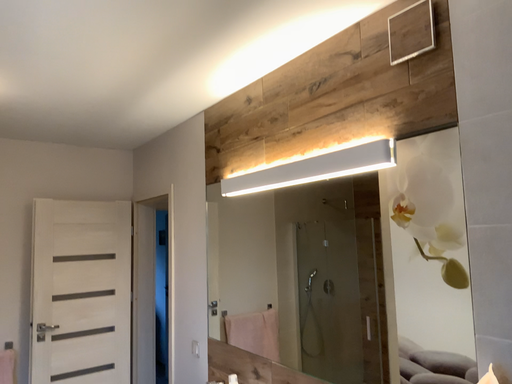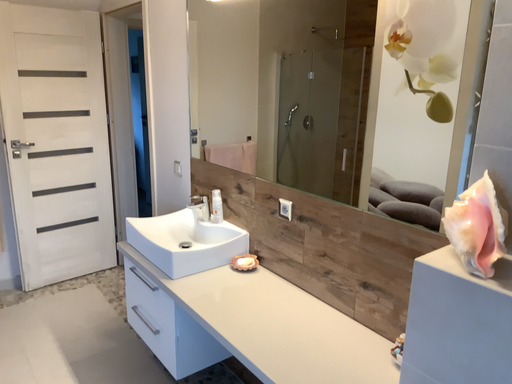
Question: How did the camera likely rotate when shooting the video?

Choices:
 (A) rotated upward
 (B) rotated downward

Answer: (B)